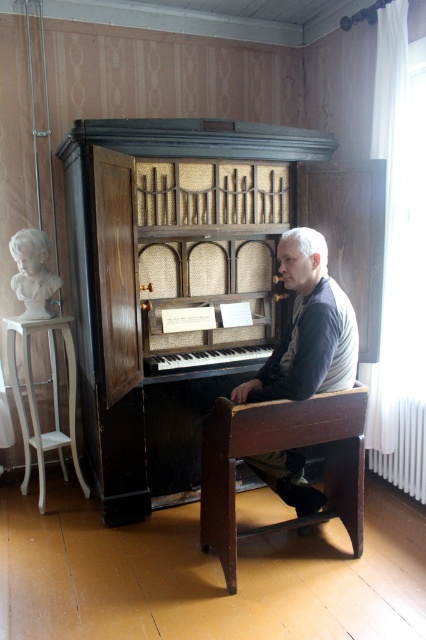
You are standing in the room and want to move from the point at coordinates point (62,465) to the point at coordinates point (37,317). Which direction should you move?

Since point (62,465) is behind point (37,317), you should move forward to reach the point at (37,317).

You are a person with a height of 6 feet. You are standing in the room and want to sit on the white wood stool at left to reach the top of the black polished wood piano at center. Can you reach the top of the piano if you stand on the stool?

The distance between the white wood stool at left and the black polished wood piano at center is 28.08 inches. However, the height of the piano and the stool are not provided, so it is impossible to determine if you can reach the top of the piano by standing on the stool.